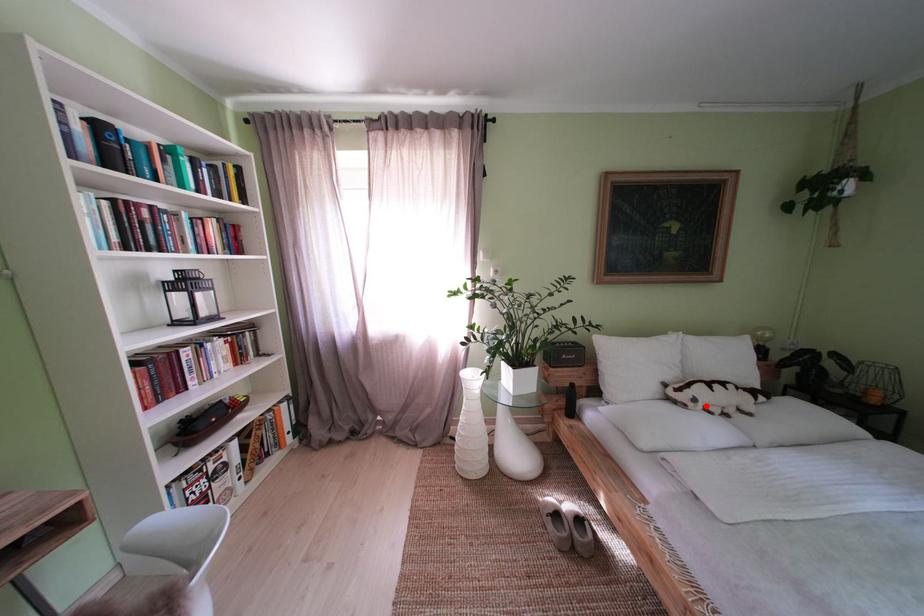
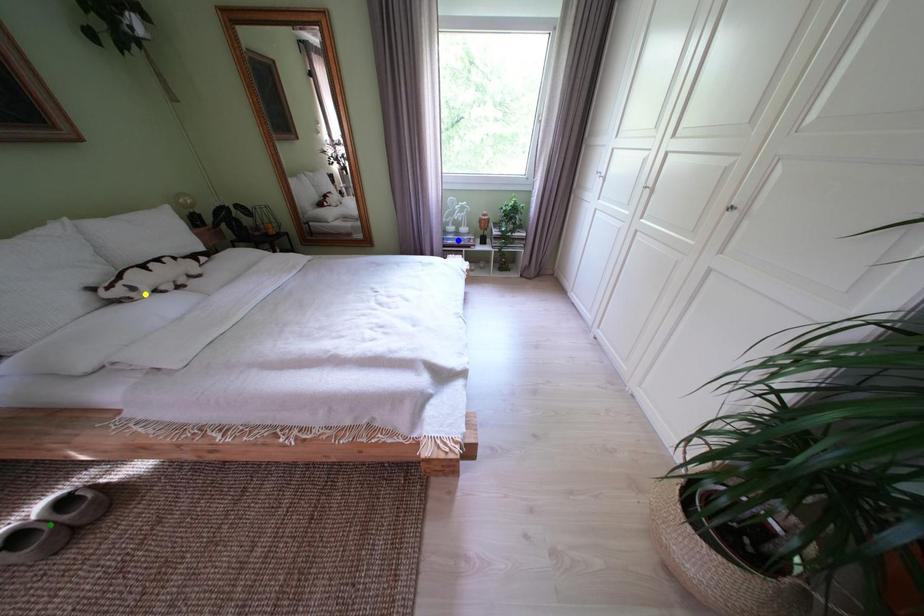
Question: I am providing you with two images of the same scene from different viewpoints. A red point is marked on the first image. You are given multiple points on the second image. Can you choose the point in image 2 that corresponds to the point in image 1?

Choices:
 (A) yellow point
 (B) blue point
 (C) green point

Answer: (A)